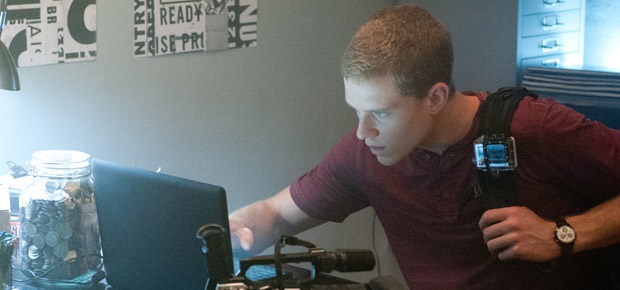
At what (x,y) coordinates should I click in order to perform the action: click on bluish gray rectangle -- laptop cover. Please return your answer as a coordinate pair (x, y). The height and width of the screenshot is (290, 620). Looking at the image, I should click on (141, 236).